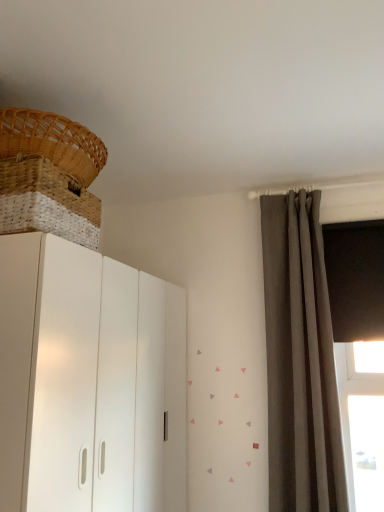
Question: Should I look upward or downward to see matte gray curtain at right?

Choices:
 (A) up
 (B) down

Answer: (B)

Question: Considering the relative positions of white matte cupboard at left and woven wood basket at upper left, the 2th basket from the top, in the image provided, is white matte cupboard at left to the right of woven wood basket at upper left, the 2th basket from the top, from the viewer's perspective?

Choices:
 (A) yes
 (B) no

Answer: (A)

Question: Does white matte cupboard at left have a lesser width compared to woven wood basket at upper left, the 2th basket from the top?

Choices:
 (A) yes
 (B) no

Answer: (B)

Question: Is white matte cupboard at left positioned with its back to woven wood basket at upper left, which is the first basket in bottom-to-top order?

Choices:
 (A) yes
 (B) no

Answer: (B)

Question: Can you see white matte cupboard at left touching woven wood basket at upper left, the 2th basket from the top?

Choices:
 (A) no
 (B) yes

Answer: (A)

Question: Can you confirm if white matte cupboard at left is taller than woven wood basket at upper left, the 2th basket from the top?

Choices:
 (A) yes
 (B) no

Answer: (A)

Question: Considering the relative sizes of white matte cupboard at left and woven wood basket at upper left, the 2th basket from the top, in the image provided, is white matte cupboard at left wider than woven wood basket at upper left, the 2th basket from the top,?

Choices:
 (A) no
 (B) yes

Answer: (B)

Question: Is woven wood basket at upper left, positioned as the 1th basket in top-to-bottom order, turned away from white matte cupboard at left?

Choices:
 (A) yes
 (B) no

Answer: (B)

Question: Can you confirm if woven wood basket at upper left, positioned as the 1th basket in top-to-bottom order, is positioned to the right of white matte cupboard at left?

Choices:
 (A) yes
 (B) no

Answer: (B)

Question: Can you confirm if woven wood basket at upper left, marked as the second basket in a bottom-to-top arrangement, is thinner than white matte cupboard at left?

Choices:
 (A) yes
 (B) no

Answer: (A)

Question: Does woven wood basket at upper left, positioned as the 1th basket in top-to-bottom order, have a smaller size compared to white matte cupboard at left?

Choices:
 (A) no
 (B) yes

Answer: (B)

Question: Does woven wood basket at upper left, marked as the second basket in a bottom-to-top arrangement, have a greater width compared to white matte cupboard at left?

Choices:
 (A) yes
 (B) no

Answer: (B)

Question: Is woven wood basket at upper left, marked as the second basket in a bottom-to-top arrangement, in front of white matte cupboard at left?

Choices:
 (A) yes
 (B) no

Answer: (B)

Question: Does matte gray curtain at right have a larger size compared to woven wood basket at upper left, the 2th basket from the top?

Choices:
 (A) no
 (B) yes

Answer: (B)